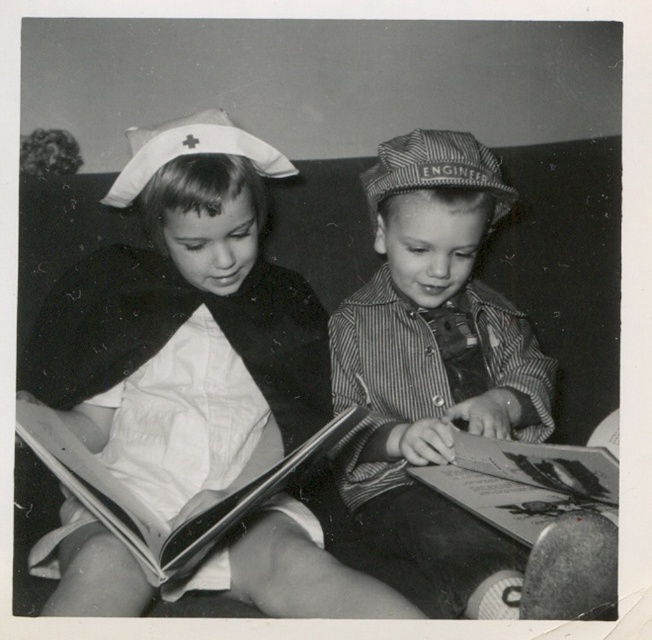
In the scene shown: Does striped cotton shirt at center have a greater height compared to thick paper book at lower left?

Yes.

Does point (509, 362) come in front of point (115, 531)?

No, (509, 362) is further to viewer.

The width and height of the screenshot is (652, 640). What do you see at coordinates (436, 365) in the screenshot? I see `striped cotton shirt at center` at bounding box center [436, 365].

The image size is (652, 640). I want to click on striped cotton shirt at center, so click(x=436, y=365).

Does white cloth dress at center have a greater height compared to paperboard book at lower center?

Yes.

Which is more to the left, white cloth dress at center or paperboard book at lower center?

white cloth dress at center

Which is behind, point (138, 401) or point (447, 465)?

The point (138, 401) is behind.

Where is `white cloth dress at center`? This screenshot has width=652, height=640. white cloth dress at center is located at coordinates (186, 330).

Can you confirm if thick paper book at lower left is positioned below paperboard book at lower center?

Indeed, thick paper book at lower left is positioned under paperboard book at lower center.

Who is taller, thick paper book at lower left or paperboard book at lower center?

thick paper book at lower left

Describe the element at coordinates (145, 506) in the screenshot. Image resolution: width=652 pixels, height=640 pixels. I see `thick paper book at lower left` at that location.

Image resolution: width=652 pixels, height=640 pixels. What are the coordinates of `thick paper book at lower left` in the screenshot? It's located at (145, 506).